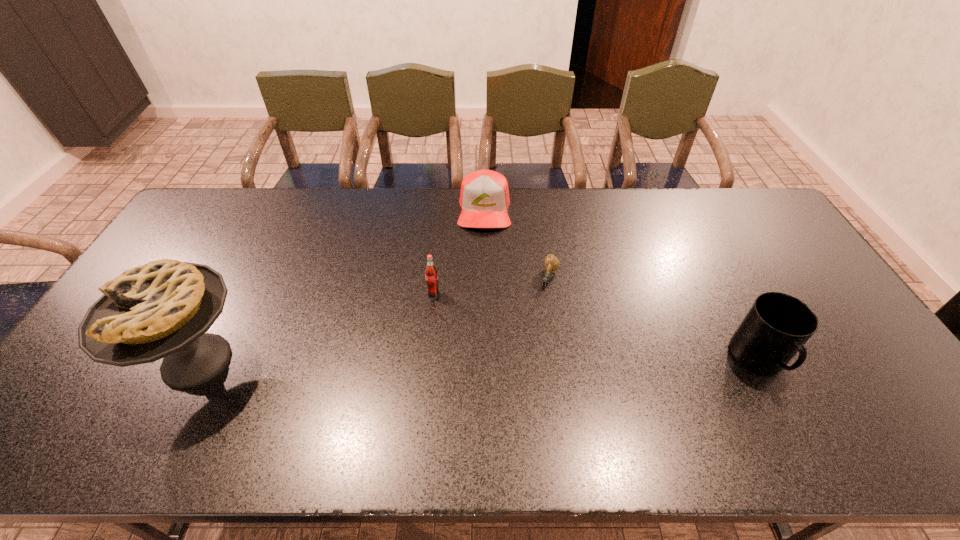
Find the location of `object that is at the far edge`. object that is at the far edge is located at coordinates [x=484, y=197].

Locate an element on the screen. pie situated at the near edge is located at coordinates coord(163,309).

Image resolution: width=960 pixels, height=540 pixels. I want to click on mug that is positioned at the near edge, so click(x=776, y=327).

I want to click on object located in the left edge section of the desktop, so click(x=163, y=309).

The width and height of the screenshot is (960, 540). What are the coordinates of `object positioned at the near left corner` in the screenshot? It's located at (163, 309).

In the image, there is a desktop. Identify the location of vacant space at the far edge. (441, 225).

This screenshot has width=960, height=540. In order to click on free space at the near edge of the desktop in this screenshot , I will do `click(209, 389)`.

This screenshot has width=960, height=540. In the image, there is a desktop. Identify the location of free space at the left edge. (174, 256).

Where is `vacant space at the right edge of the desktop`? vacant space at the right edge of the desktop is located at coordinates (785, 240).

You are a GUI agent. You are given a task and a screenshot of the screen. Output one action in this format:
    pyautogui.click(x=<x>, y=<y>)
    Task: Click on the vacant area at the near right corner
    This screenshot has width=960, height=540.
    Given the screenshot: What is the action you would take?
    (904, 406)